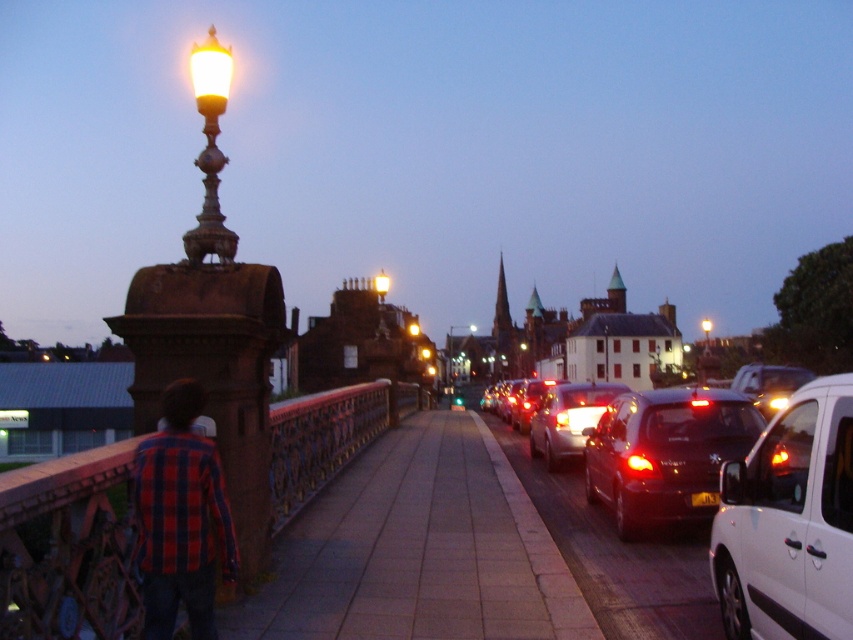
Question: Which object appears closest to the camera in this image?

Choices:
 (A) matte glass street light at upper center
 (B) metallic brown bridge at center
 (C) plaid shirt at left

Answer: (B)

Question: Is plaid shirt at left above green glass street light at center?

Choices:
 (A) yes
 (B) no

Answer: (A)

Question: Where is plaid shirt at left located in relation to green glass street light at center in the image?

Choices:
 (A) right
 (B) left

Answer: (B)

Question: Does white matte van at right lie behind shiny red car at center right?

Choices:
 (A) no
 (B) yes

Answer: (A)

Question: Considering the real-world distances, which object is farthest from the shiny dark red car at right?

Choices:
 (A) plaid shirt at left
 (B) green glass street light at center
 (C) shiny black sedan at center right

Answer: (B)

Question: Estimate the real-world distances between objects in this image. Which object is closer to the matte glass street light at upper center?

Choices:
 (A) shiny black sedan at center right
 (B) metallic brown bridge at center
 (C) gray concrete pavement at center

Answer: (C)